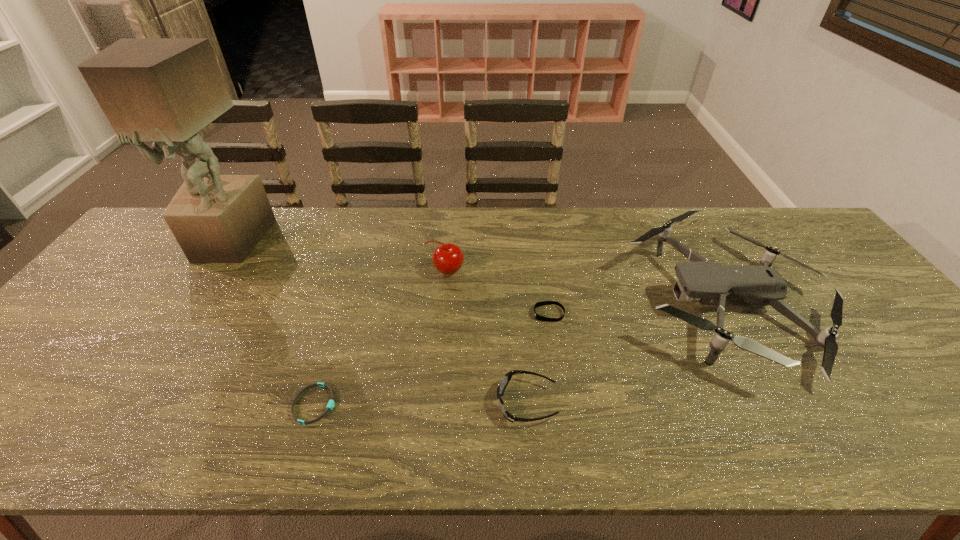
Locate an element on the screen. vacant space situated on the front-facing side of the drone is located at coordinates (557, 303).

At what (x,y) coordinates should I click in order to perform the action: click on vacant area situated on the front-facing side of the drone. Please return your answer as a coordinate pair (x, y). The image size is (960, 540). Looking at the image, I should click on (501, 303).

Where is `vacant area situated on the front-facing side of the drone`? vacant area situated on the front-facing side of the drone is located at coordinates (516, 303).

This screenshot has width=960, height=540. What are the coordinates of `vacant region located on the left of the cherry` in the screenshot? It's located at (407, 271).

Identify the location of vacant space located 0.200m on the lenses of the third shortest object. (406, 402).

You are a GUI agent. You are given a task and a screenshot of the screen. Output one action in this format:
    pyautogui.click(x=<x>, y=<y>)
    Task: Click on the free space located on the lenses of the third shortest object
    
    Given the screenshot: What is the action you would take?
    pyautogui.click(x=351, y=402)

The image size is (960, 540). What are the coordinates of `vacant region located on the lenses of the third shortest object` in the screenshot? It's located at (365, 402).

The width and height of the screenshot is (960, 540). I want to click on vacant space situated on the display of the second shortest object, so click(484, 314).

You are a GUI agent. You are given a task and a screenshot of the screen. Output one action in this format:
    pyautogui.click(x=<x>, y=<y>)
    Task: Click on the free space located 0.380m on the display of the second shortest object
    
    Given the screenshot: What is the action you would take?
    pyautogui.click(x=389, y=314)

Where is `free space located on the display of the second shortest object`? This screenshot has height=540, width=960. free space located on the display of the second shortest object is located at coordinates (453, 314).